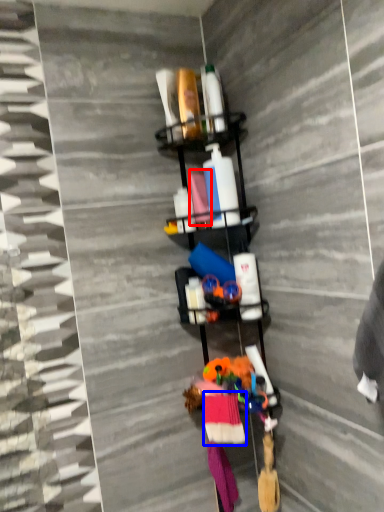
Question: Which of the following is the farthest to the observer, fabric (highlighted by a red box) or clothing (highlighted by a blue box)?

Choices:
 (A) fabric
 (B) clothing

Answer: (A)